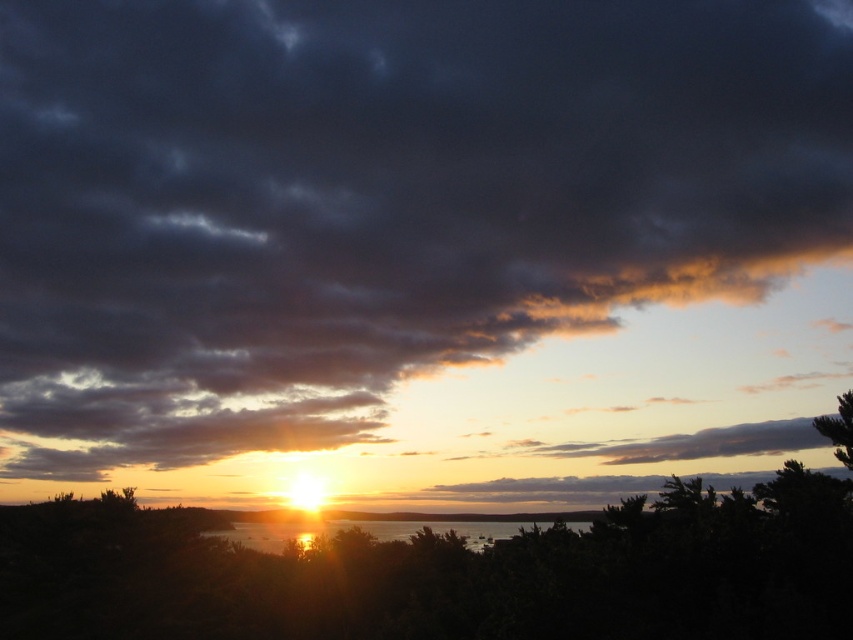
Is point (270, 548) more distant than point (839, 404)?

Yes, it is.

Is shiny reflective water at center thinner than green leafy tree at lower right?

Correct, shiny reflective water at center's width is less than green leafy tree at lower right's.

What do you see at coordinates (369, 531) in the screenshot? I see `shiny reflective water at center` at bounding box center [369, 531].

Identify the location of shiny reflective water at center. (369, 531).